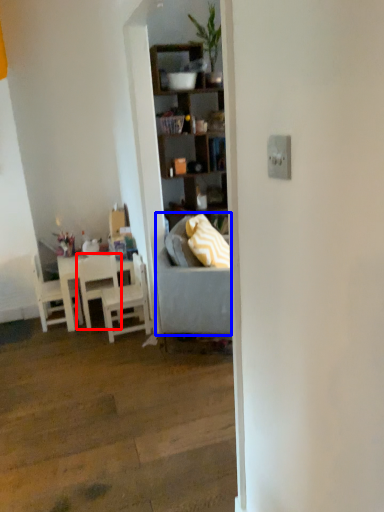
Question: Which of the following is the farthest to the observer, chair (highlighted by a red box) or studio couch (highlighted by a blue box)?

Choices:
 (A) chair
 (B) studio couch

Answer: (A)